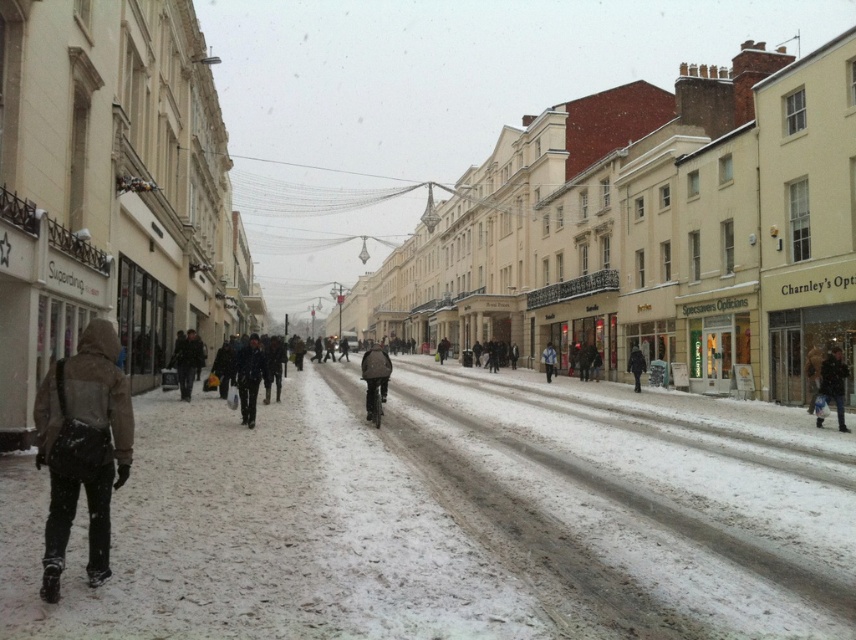
You are a delivery person trying to walk from the Superdrug store to the Charnley Opticians store. You see the white powdery snow at lower left and the dark gray coat at center. Which object is closer to your path?

The white powdery snow at lower left is in front of the dark gray coat at center, so it is closer to your path.

You are standing in the snowy street and see the white powdery snow at lower left and the dark gray jacket at center. Which object is positioned more to the right?

The white powdery snow at lower left is to the right of dark gray jacket at center.